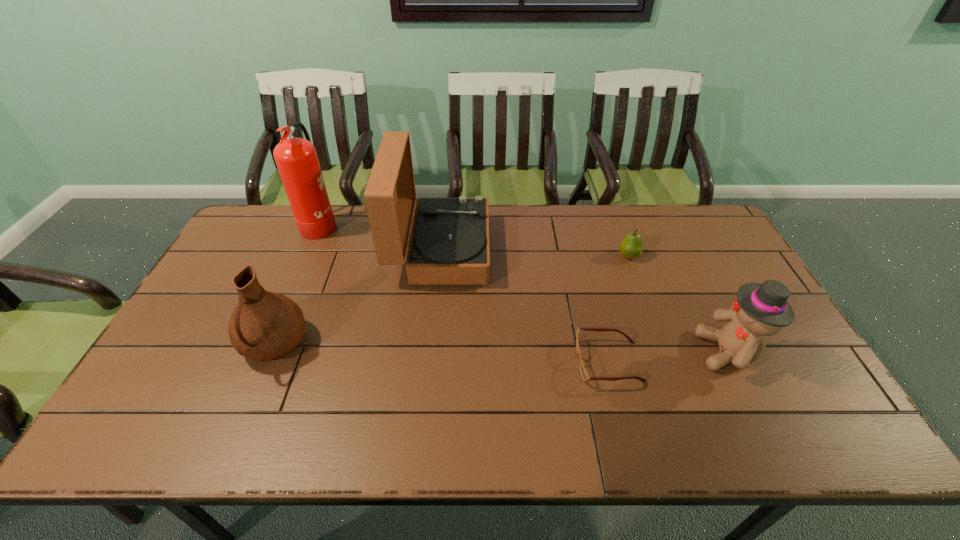
Where is `free space that satisfies the following two spatial constraints: 1. on the face of the phonograph record; 2. on the back side of the pear`? This screenshot has width=960, height=540. free space that satisfies the following two spatial constraints: 1. on the face of the phonograph record; 2. on the back side of the pear is located at coordinates (440, 256).